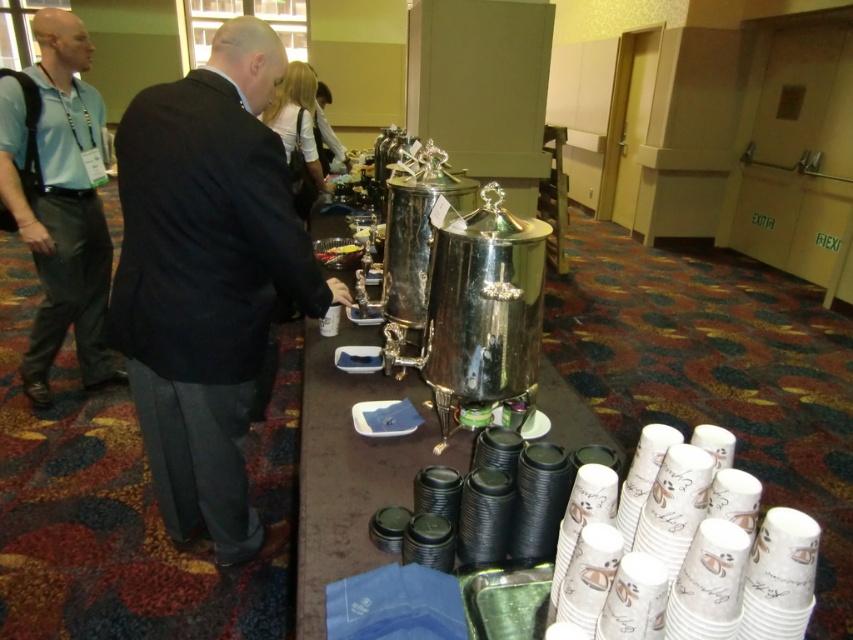
Question: Which of the following is the closest to the observer?

Choices:
 (A) matte blue shirt at left
 (B) black suit at center
 (C) shiny silver tray at center

Answer: (B)

Question: Among these objects, which one is nearest to the camera?

Choices:
 (A) shiny silver tray at center
 (B) polished silver coffee pot at center
 (C) black suit at center

Answer: (B)

Question: Does black suit at center have a smaller size compared to shiny silver tray at center?

Choices:
 (A) no
 (B) yes

Answer: (A)

Question: Is black suit at center wider than matte blue shirt at left?

Choices:
 (A) no
 (B) yes

Answer: (B)

Question: Is black suit at center in front of polished silver coffee pot at center?

Choices:
 (A) yes
 (B) no

Answer: (B)

Question: Based on their relative distances, which object is nearer to the matte blue shirt at left?

Choices:
 (A) polished silver coffee pot at center
 (B) shiny silver tray at center
 (C) black suit at center

Answer: (B)